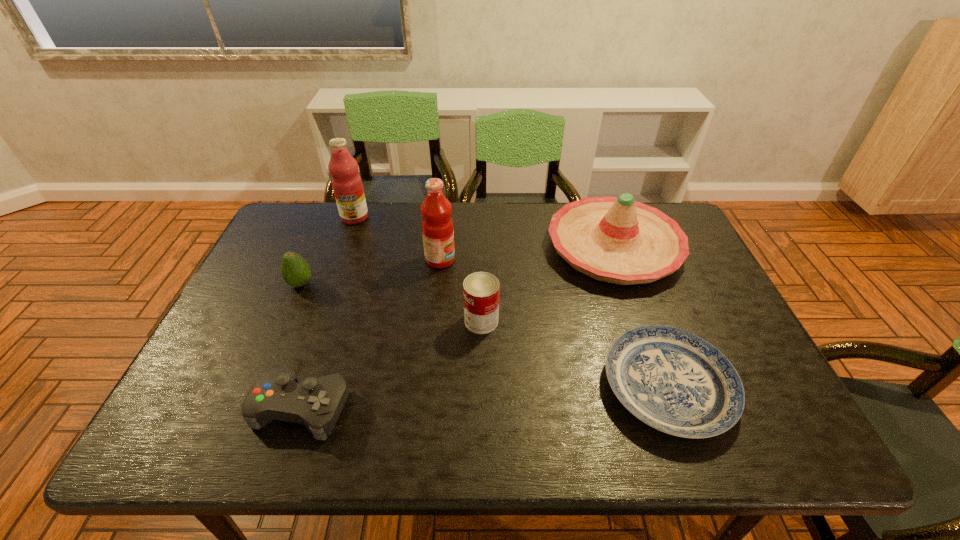
At what (x,y) coordinates should I click in order to perform the action: click on vacant space located on the front label of the right fruit juice. Please return your answer as a coordinate pair (x, y). This screenshot has height=540, width=960. Looking at the image, I should click on (562, 260).

The image size is (960, 540). I want to click on vacant space located 0.270m on the front of the sombrero, so click(660, 376).

Where is `vacant area situated 0.180m on the front label of the can`? The height and width of the screenshot is (540, 960). vacant area situated 0.180m on the front label of the can is located at coordinates (396, 321).

Where is `vacant space positioned 0.240m on the front label of the can`? This screenshot has height=540, width=960. vacant space positioned 0.240m on the front label of the can is located at coordinates (372, 321).

You are a GUI agent. You are given a task and a screenshot of the screen. Output one action in this format:
    pyautogui.click(x=<x>, y=<y>)
    Task: Click on the vacant space located 0.100m on the front label of the can
    The width and height of the screenshot is (960, 540).
    Given the screenshot: What is the action you would take?
    pyautogui.click(x=426, y=321)

Locate an element on the screen. The image size is (960, 540). vacant space located on the back of the avocado is located at coordinates click(x=325, y=226).

You are a GUI agent. You are given a task and a screenshot of the screen. Output one action in this format:
    pyautogui.click(x=<x>, y=<y>)
    Task: Click on the vacant space located 0.240m on the back of the second shortest object
    
    Given the screenshot: What is the action you would take?
    point(336,302)

Locate an element on the screen. This screenshot has height=540, width=960. vacant region located on the left of the plate is located at coordinates (573, 386).

At what (x,y) coordinates should I click in order to perform the action: click on fruit juice that is at the far edge. Please return your answer as a coordinate pair (x, y). Looking at the image, I should click on (347, 185).

Locate an element on the screen. The height and width of the screenshot is (540, 960). sombrero situated at the far edge is located at coordinates pos(619,240).